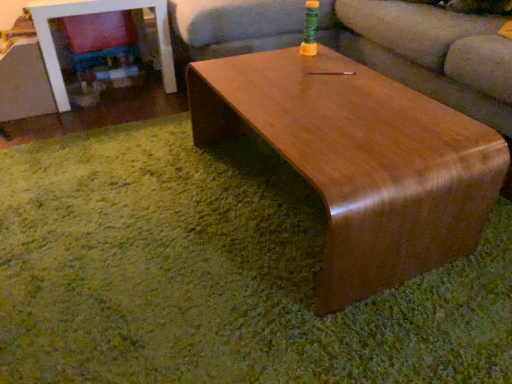
What are the coordinates of `vacant point above shiny brown wood coffee table at center (from a real-world perspective)` in the screenshot? It's located at (340, 109).